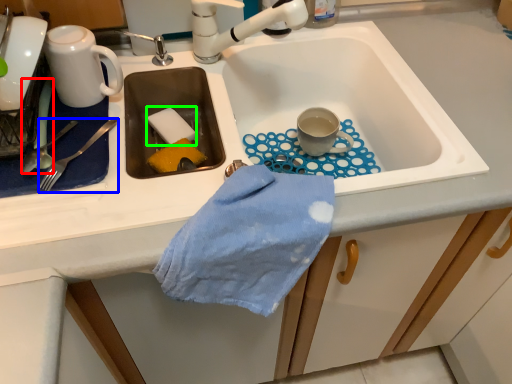
Question: Which is farther away from silverware (highlighted by a red box)? silverware (highlighted by a blue box) or food (highlighted by a green box)?

Choices:
 (A) silverware
 (B) food

Answer: (B)